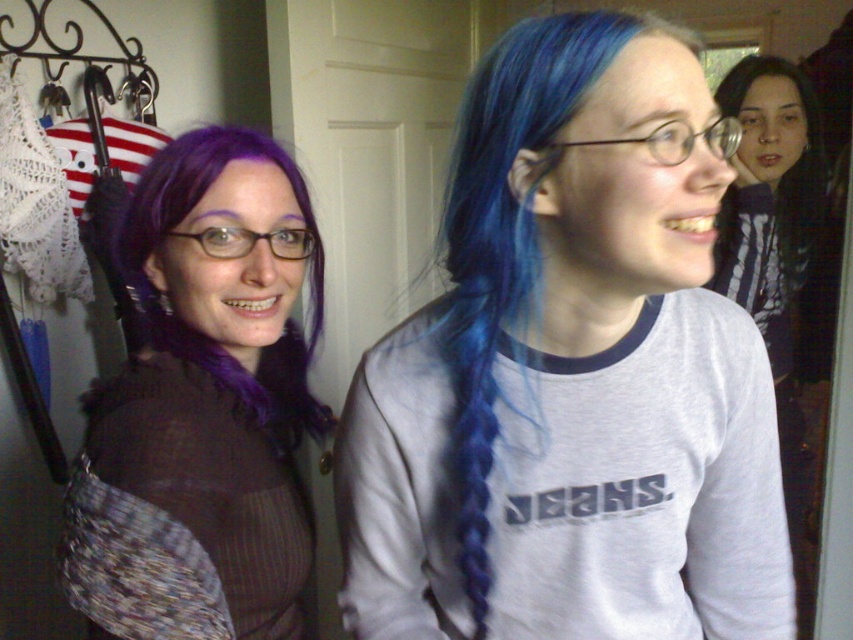
Question: Is blue hair at center bigger than blue dyed hair at upper right?

Choices:
 (A) yes
 (B) no

Answer: (A)

Question: Based on their relative distances, which object is farther from the blue hair at center?

Choices:
 (A) purple matte hair at upper left
 (B) blue dyed hair at upper right

Answer: (B)

Question: Which point is farther from the camera taking this photo?

Choices:
 (A) (798, 176)
 (B) (148, 481)
 (C) (463, 188)

Answer: (A)

Question: Can you confirm if blue hair at upper right is positioned below blue dyed hair at upper right?

Choices:
 (A) no
 (B) yes

Answer: (B)

Question: Which is nearer to the blue hair at center?

Choices:
 (A) purple matte hair at upper left
 (B) blue dyed hair at upper right

Answer: (A)

Question: Can you confirm if purple matte hair at upper left is positioned below blue dyed hair at upper right?

Choices:
 (A) yes
 (B) no

Answer: (A)